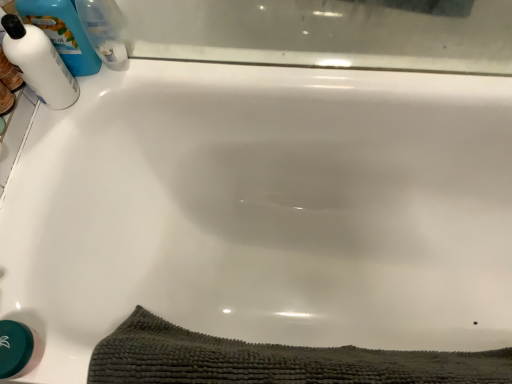
The height and width of the screenshot is (384, 512). What are the coordinates of `white glossy bottle at upper left, the 2th cleaning product viewed from the right` in the screenshot? It's located at (62, 32).

What do you see at coordinates (39, 63) in the screenshot? This screenshot has height=384, width=512. I see `white glossy bottle at upper left, which is the 3th cleaning product in right-to-left order` at bounding box center [39, 63].

The height and width of the screenshot is (384, 512). Identify the location of blue plastic bottle at upper left, which is counted as the first cleaning product, starting from the right. tap(104, 31).

Where is `white glossy bottle at upper left, the 2th cleaning product in the left-to-right sequence`? The width and height of the screenshot is (512, 384). white glossy bottle at upper left, the 2th cleaning product in the left-to-right sequence is located at coordinates (62, 32).

Does dark gray textured bath towel at lower center have a greater height compared to blue plastic bottle at upper left, which is counted as the first cleaning product, starting from the right?

Indeed, dark gray textured bath towel at lower center has a greater height compared to blue plastic bottle at upper left, which is counted as the first cleaning product, starting from the right.

From a real-world perspective, is dark gray textured bath towel at lower center located beneath blue plastic bottle at upper left, which is counted as the first cleaning product, starting from the right?

Correct, in the physical world, dark gray textured bath towel at lower center is lower than blue plastic bottle at upper left, which is counted as the first cleaning product, starting from the right.

Where is `bath towel in front of the blue plastic bottle at upper left, arranged as the third cleaning product when viewed from the left`? bath towel in front of the blue plastic bottle at upper left, arranged as the third cleaning product when viewed from the left is located at coordinates (273, 360).

How many degrees apart are the facing directions of dark gray textured bath towel at lower center and blue plastic bottle at upper left, which is counted as the first cleaning product, starting from the right?

The facing directions of dark gray textured bath towel at lower center and blue plastic bottle at upper left, which is counted as the first cleaning product, starting from the right, are 4.33 degrees apart.

How many degrees apart are the facing directions of dark gray textured bath towel at lower center and white glossy bottle at upper left, which is the 3th cleaning product in right-to-left order?

The angular difference between dark gray textured bath towel at lower center and white glossy bottle at upper left, which is the 3th cleaning product in right-to-left order, is 87.2 degrees.

Which is behind, point (348, 372) or point (8, 36)?

The point (8, 36) is more distant.

From a real-world perspective, who is located lower, dark gray textured bath towel at lower center or white glossy bottle at upper left, which is the 3th cleaning product in right-to-left order?

From a 3D spatial view, dark gray textured bath towel at lower center is below.

Choose the correct answer: Is dark gray textured bath towel at lower center inside white glossy bottle at upper left, the 1th cleaning product in the left-to-right sequence, or outside it?

dark gray textured bath towel at lower center is spatially situated outside white glossy bottle at upper left, the 1th cleaning product in the left-to-right sequence.

In the scene shown: Is blue plastic bottle at upper left, arranged as the third cleaning product when viewed from the left, inside white glossy bottle at upper left, the 1th cleaning product in the left-to-right sequence?

No, blue plastic bottle at upper left, arranged as the third cleaning product when viewed from the left, is not a part of white glossy bottle at upper left, the 1th cleaning product in the left-to-right sequence.

Considering their positions, is white glossy bottle at upper left, which is the 3th cleaning product in right-to-left order, located in front of or behind blue plastic bottle at upper left, arranged as the third cleaning product when viewed from the left?

Clearly, white glossy bottle at upper left, which is the 3th cleaning product in right-to-left order, is in front of blue plastic bottle at upper left, arranged as the third cleaning product when viewed from the left.

Does white glossy bottle at upper left, the 1th cleaning product in the left-to-right sequence, have a larger size compared to blue plastic bottle at upper left, arranged as the third cleaning product when viewed from the left?

Yes, white glossy bottle at upper left, the 1th cleaning product in the left-to-right sequence, is bigger than blue plastic bottle at upper left, arranged as the third cleaning product when viewed from the left.

From a real-world perspective, between dark gray textured bath towel at lower center and white glossy bottle at upper left, the 2th cleaning product in the left-to-right sequence, who is vertically higher?

In real-world perspective, white glossy bottle at upper left, the 2th cleaning product in the left-to-right sequence, is above.

Where is `bath towel that is in front of the white glossy bottle at upper left, the 2th cleaning product viewed from the right`? The width and height of the screenshot is (512, 384). bath towel that is in front of the white glossy bottle at upper left, the 2th cleaning product viewed from the right is located at coordinates (273, 360).

From the image's perspective, which one is positioned higher, dark gray textured bath towel at lower center or white glossy bottle at upper left, the 2th cleaning product viewed from the right?

white glossy bottle at upper left, the 2th cleaning product viewed from the right, appears higher in the image.

Is dark gray textured bath towel at lower center not within white glossy bottle at upper left, the 2th cleaning product in the left-to-right sequence?

That's correct, dark gray textured bath towel at lower center is outside of white glossy bottle at upper left, the 2th cleaning product in the left-to-right sequence.

Between white glossy bottle at upper left, the 1th cleaning product in the left-to-right sequence, and dark gray textured bath towel at lower center, which one has larger size?

Bigger between the two is dark gray textured bath towel at lower center.

Which is less distant, [26,43] or [195,362]?

Point [26,43] is positioned farther from the camera compared to point [195,362].

Visually, is white glossy bottle at upper left, the 1th cleaning product in the left-to-right sequence, positioned to the left or to the right of dark gray textured bath towel at lower center?

white glossy bottle at upper left, the 1th cleaning product in the left-to-right sequence, is positioned on dark gray textured bath towel at lower center's left side.

From the image's perspective, is white glossy bottle at upper left, which is the 3th cleaning product in right-to-left order, on dark gray textured bath towel at lower center?

Yes, from the image's perspective, white glossy bottle at upper left, which is the 3th cleaning product in right-to-left order, is over dark gray textured bath towel at lower center.

The height and width of the screenshot is (384, 512). I want to click on cleaning product that is the 1st one when counting leftward from the dark gray textured bath towel at lower center, so click(104, 31).

Considering the sizes of objects blue plastic bottle at upper left, which is counted as the first cleaning product, starting from the right, and dark gray textured bath towel at lower center in the image provided, who is bigger, blue plastic bottle at upper left, which is counted as the first cleaning product, starting from the right, or dark gray textured bath towel at lower center?

With larger size is dark gray textured bath towel at lower center.

Relative to dark gray textured bath towel at lower center, is blue plastic bottle at upper left, arranged as the third cleaning product when viewed from the left, in front or behind?

In the image, blue plastic bottle at upper left, arranged as the third cleaning product when viewed from the left, appears behind dark gray textured bath towel at lower center.

From a real-world perspective, is blue plastic bottle at upper left, which is counted as the first cleaning product, starting from the right, physically below dark gray textured bath towel at lower center?

No, from a real-world perspective, blue plastic bottle at upper left, which is counted as the first cleaning product, starting from the right, is not below dark gray textured bath towel at lower center.

Is white glossy bottle at upper left, the 2th cleaning product in the left-to-right sequence, not close to white glossy bottle at upper left, the 1th cleaning product in the left-to-right sequence?

No, white glossy bottle at upper left, the 2th cleaning product in the left-to-right sequence, is not far from white glossy bottle at upper left, the 1th cleaning product in the left-to-right sequence.

In terms of size, does white glossy bottle at upper left, the 2th cleaning product viewed from the right, appear bigger or smaller than white glossy bottle at upper left, the 1th cleaning product in the left-to-right sequence?

Clearly, white glossy bottle at upper left, the 2th cleaning product viewed from the right, is larger in size than white glossy bottle at upper left, the 1th cleaning product in the left-to-right sequence.

From the picture: From the image's perspective, who appears lower, white glossy bottle at upper left, the 2th cleaning product in the left-to-right sequence, or white glossy bottle at upper left, the 1th cleaning product in the left-to-right sequence?

white glossy bottle at upper left, the 1th cleaning product in the left-to-right sequence, appears lower in the image.

How much distance is there between white glossy bottle at upper left, the 2th cleaning product viewed from the right, and white glossy bottle at upper left, the 1th cleaning product in the left-to-right sequence?

The distance of white glossy bottle at upper left, the 2th cleaning product viewed from the right, from white glossy bottle at upper left, the 1th cleaning product in the left-to-right sequence, is 2.38 inches.

At what (x,y) coordinates should I click in order to perform the action: click on the 3rd cleaning product behind the dark gray textured bath towel at lower center. Please return your answer as a coordinate pair (x, y). This screenshot has height=384, width=512. Looking at the image, I should click on (104, 31).

Identify the location of the 2nd cleaning product positioned above the dark gray textured bath towel at lower center (from a real-world perspective). The height and width of the screenshot is (384, 512). (39, 63).

Based on their spatial positions, is dark gray textured bath towel at lower center or blue plastic bottle at upper left, which is counted as the first cleaning product, starting from the right, further from white glossy bottle at upper left, the 2th cleaning product in the left-to-right sequence?

dark gray textured bath towel at lower center is positioned further to the anchor white glossy bottle at upper left, the 2th cleaning product in the left-to-right sequence.

Considering their positions, is blue plastic bottle at upper left, which is counted as the first cleaning product, starting from the right, positioned further to dark gray textured bath towel at lower center than white glossy bottle at upper left, which is the 3th cleaning product in right-to-left order?

blue plastic bottle at upper left, which is counted as the first cleaning product, starting from the right, is further to dark gray textured bath towel at lower center.

Estimate the real-world distances between objects in this image. Which object is further from blue plastic bottle at upper left, which is counted as the first cleaning product, starting from the right, white glossy bottle at upper left, which is the 3th cleaning product in right-to-left order, or white glossy bottle at upper left, the 2th cleaning product in the left-to-right sequence?

white glossy bottle at upper left, which is the 3th cleaning product in right-to-left order, lies further to blue plastic bottle at upper left, which is counted as the first cleaning product, starting from the right, than the other object.

When comparing their distances from blue plastic bottle at upper left, arranged as the third cleaning product when viewed from the left, does white glossy bottle at upper left, the 1th cleaning product in the left-to-right sequence, or dark gray textured bath towel at lower center seem further?

Based on the image, dark gray textured bath towel at lower center appears to be further to blue plastic bottle at upper left, arranged as the third cleaning product when viewed from the left.

Based on their spatial positions, is white glossy bottle at upper left, the 2th cleaning product viewed from the right, or blue plastic bottle at upper left, which is counted as the first cleaning product, starting from the right, closer to white glossy bottle at upper left, which is the 3th cleaning product in right-to-left order?

white glossy bottle at upper left, the 2th cleaning product viewed from the right, is positioned closer to the anchor white glossy bottle at upper left, which is the 3th cleaning product in right-to-left order.

Based on their spatial positions, is blue plastic bottle at upper left, which is counted as the first cleaning product, starting from the right, or dark gray textured bath towel at lower center further from white glossy bottle at upper left, which is the 3th cleaning product in right-to-left order?

dark gray textured bath towel at lower center is further to white glossy bottle at upper left, which is the 3th cleaning product in right-to-left order.

From the image, which object appears to be nearer to white glossy bottle at upper left, the 2th cleaning product in the left-to-right sequence, dark gray textured bath towel at lower center or white glossy bottle at upper left, the 1th cleaning product in the left-to-right sequence?

white glossy bottle at upper left, the 1th cleaning product in the left-to-right sequence.

Estimate the real-world distances between objects in this image. Which object is closer to white glossy bottle at upper left, the 2th cleaning product viewed from the right, white glossy bottle at upper left, which is the 3th cleaning product in right-to-left order, or blue plastic bottle at upper left, arranged as the third cleaning product when viewed from the left?

Based on the image, white glossy bottle at upper left, which is the 3th cleaning product in right-to-left order, appears to be nearer to white glossy bottle at upper left, the 2th cleaning product viewed from the right.

Locate an element on the screen. cleaning product that lies between blue plastic bottle at upper left, arranged as the third cleaning product when viewed from the left, and dark gray textured bath towel at lower center from top to bottom is located at coordinates (39, 63).

Image resolution: width=512 pixels, height=384 pixels. In order to click on cleaning product between white glossy bottle at upper left, the 1th cleaning product in the left-to-right sequence, and blue plastic bottle at upper left, arranged as the third cleaning product when viewed from the left, from left to right in this screenshot , I will do `click(62, 32)`.